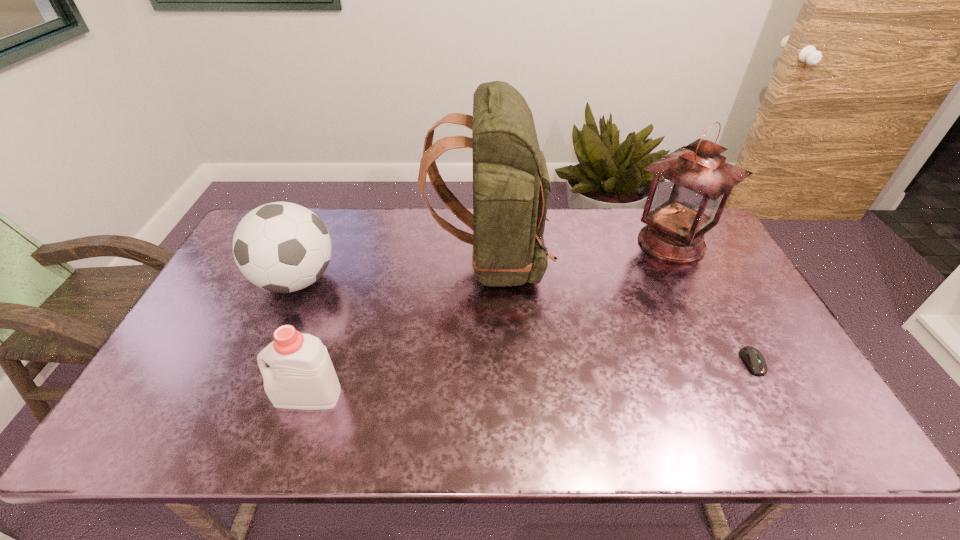
Locate an element on the screen. empty location between the soccer ball and the computer equipment is located at coordinates (524, 321).

At what (x,y) coordinates should I click in order to perform the action: click on free spot between the fourth farthest object and the detergent. Please return your answer as a coordinate pair (x, y). The image size is (960, 540). Looking at the image, I should click on (530, 379).

Where is `unoccupied position between the tallest object and the fourth farthest object`? This screenshot has width=960, height=540. unoccupied position between the tallest object and the fourth farthest object is located at coordinates (621, 311).

Find the location of `object identified as the fourth closest to the tallest object`. object identified as the fourth closest to the tallest object is located at coordinates (752, 356).

Select which object appears as the second closest to the oil lamp. Please provide its 2D coordinates. Your answer should be formatted as a tuple, i.e. [(x, y)], where the tuple contains the x and y coordinates of a point satisfying the conditions above.

[(752, 356)]